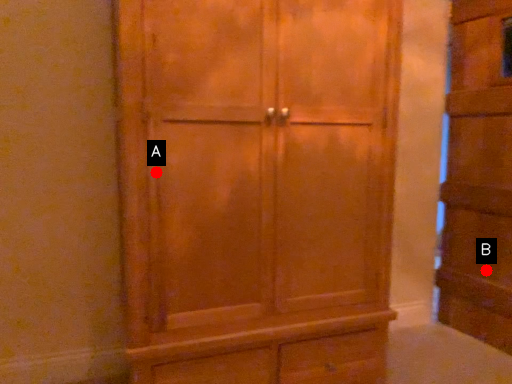
Question: Two points are circled on the image, labeled by A and B beside each circle. Which point is further to the camera?

Choices:
 (A) A is further
 (B) B is further

Answer: (B)